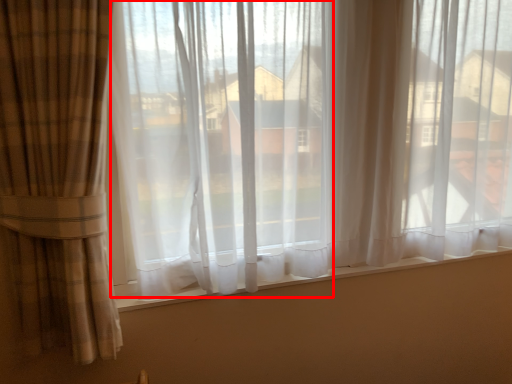
Question: From the image's perspective, what is the correct spatial positioning of window screen (annotated by the red box) in reference to window sill?

Choices:
 (A) below
 (B) above

Answer: (B)